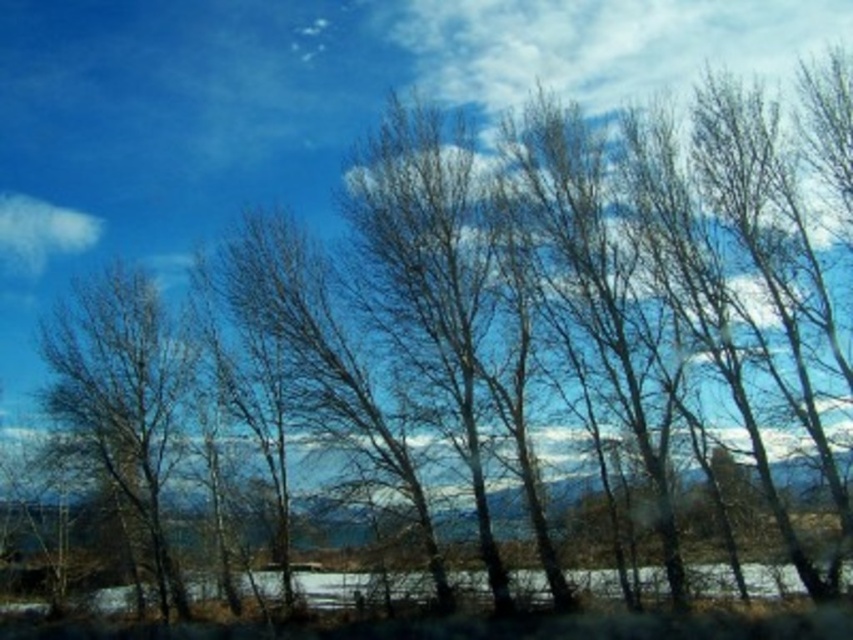
Question: Which of the following is the closest to the observer?

Choices:
 (A) white fluffy cloud at upper left
 (B) bare branches at left

Answer: (B)

Question: Is bare branches at left thinner than white fluffy cloud at upper left?

Choices:
 (A) yes
 (B) no

Answer: (B)

Question: Is bare branches at left above white fluffy cloud at upper left?

Choices:
 (A) yes
 (B) no

Answer: (B)

Question: Does bare branches at left come behind white fluffy cloud at upper left?

Choices:
 (A) no
 (B) yes

Answer: (A)

Question: Which point is closer to the camera?

Choices:
 (A) (154, 320)
 (B) (24, 195)

Answer: (A)